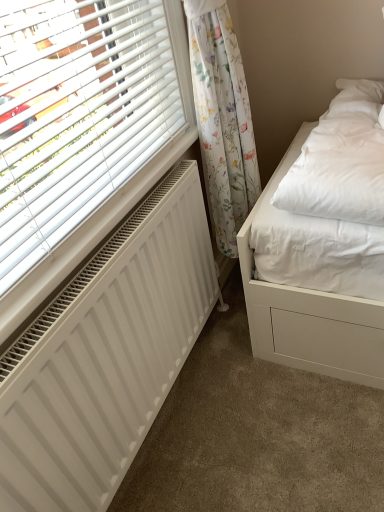
Locate an element on the screen. free space above white matte radiator at lower left (from a real-world perspective) is located at coordinates (122, 238).